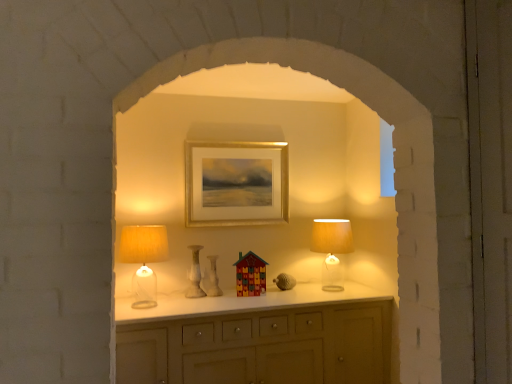
Question: Is translucent glass table lamp at right, acting as the first table lamp starting from the back, further to the viewer compared to white glossy vase at center, the first vase when ordered from right to left?

Choices:
 (A) no
 (B) yes

Answer: (A)

Question: Are translucent glass table lamp at right, marked as the second table lamp in a left-to-right arrangement, and white glossy vase at center, the first vase when ordered from right to left, located far from each other?

Choices:
 (A) yes
 (B) no

Answer: (B)

Question: Is the position of translucent glass table lamp at right, marked as the second table lamp in a left-to-right arrangement, less distant than that of white glossy vase at center, acting as the second vase starting from the left?

Choices:
 (A) no
 (B) yes

Answer: (B)

Question: Is translucent glass table lamp at right, marked as the second table lamp in a left-to-right arrangement, positioned with its back to white glossy vase at center, acting as the second vase starting from the left?

Choices:
 (A) yes
 (B) no

Answer: (B)

Question: Considering the relative sizes of translucent glass table lamp at right, the 1th table lamp in the right-to-left sequence, and white glossy vase at center, the first vase when ordered from right to left, in the image provided, is translucent glass table lamp at right, the 1th table lamp in the right-to-left sequence, taller than white glossy vase at center, the first vase when ordered from right to left,?

Choices:
 (A) no
 (B) yes

Answer: (B)

Question: Visually, is white glossy vase at center, the first vase when ordered from right to left, positioned to the left or to the right of translucent glass table lamp at right, the 1th table lamp in the right-to-left sequence?

Choices:
 (A) right
 (B) left

Answer: (B)

Question: In terms of size, does white glossy vase at center, the first vase when ordered from right to left, appear bigger or smaller than translucent glass table lamp at right, which appears as the second table lamp when viewed from the front?

Choices:
 (A) big
 (B) small

Answer: (B)

Question: Considering the positions of point (205, 281) and point (347, 233), is point (205, 281) closer or farther from the camera than point (347, 233)?

Choices:
 (A) farther
 (B) closer

Answer: (A)

Question: From a real-world perspective, is white glossy vase at center, the first vase when ordered from right to left, physically located above or below translucent glass table lamp at right, marked as the second table lamp in a left-to-right arrangement?

Choices:
 (A) above
 (B) below

Answer: (B)

Question: From a real-world perspective, is matte yellow fabric lampshade at left, the first table lamp when ordered from front to back, physically located above or below wooden multicolored house at center?

Choices:
 (A) above
 (B) below

Answer: (A)

Question: Based on their sizes in the image, would you say matte yellow fabric lampshade at left, the first table lamp when ordered from front to back, is bigger or smaller than wooden multicolored house at center?

Choices:
 (A) small
 (B) big

Answer: (B)

Question: Considering the positions of point (148, 246) and point (245, 258), is point (148, 246) closer or farther from the camera than point (245, 258)?

Choices:
 (A) farther
 (B) closer

Answer: (B)

Question: Is matte yellow fabric lampshade at left, which is the second table lamp from back to front, inside or outside of wooden multicolored house at center?

Choices:
 (A) outside
 (B) inside

Answer: (A)

Question: In terms of width, does white marble vase at center, which is the 1th vase from left to right, look wider or thinner when compared to matte yellow fabric lampshade at left, the first table lamp when ordered from front to back?

Choices:
 (A) thin
 (B) wide

Answer: (A)

Question: Is white marble vase at center, which is the 1th vase from left to right, in front of or behind matte yellow fabric lampshade at left, which ranks as the second table lamp in right-to-left order, in the image?

Choices:
 (A) front
 (B) behind

Answer: (B)